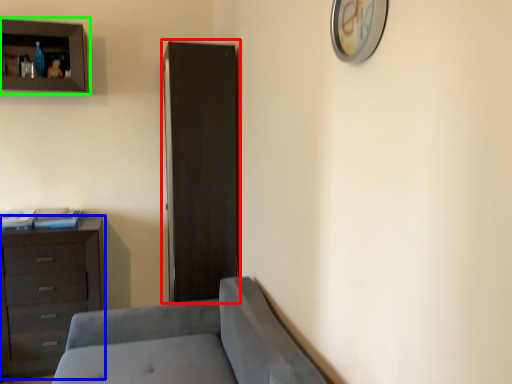
Question: Which object is positioned farthest from file cabinet (highlighted by a red box)? Select from chest of drawers (highlighted by a blue box) and cupboard (highlighted by a green box).

Choices:
 (A) chest of drawers
 (B) cupboard

Answer: (B)